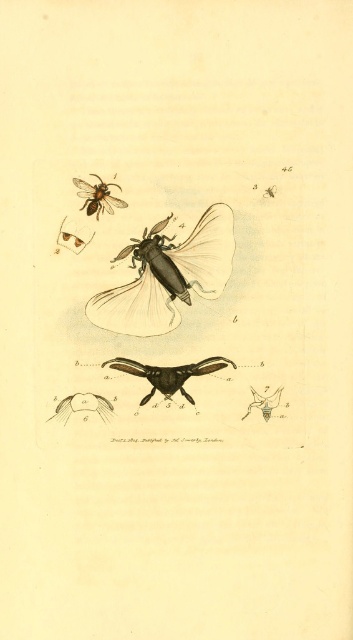
Does black glossy moth at center appear over matte brown bee at upper left?

No.

How much distance is there between black glossy moth at center and matte brown bee at upper left?

They are 12.87 inches apart.

Between point (140, 372) and point (92, 193), which one is positioned in front?

Point (92, 193) is more forward.

Find the location of a particular element. black glossy moth at center is located at coordinates (168, 372).

Between point (151, 384) and point (62, 404), which one is positioned behind?

The point (151, 384) is more distant.

Is black glossy moth at center wider than smooth brown feather at lower left?

Yes, black glossy moth at center is wider than smooth brown feather at lower left.

What do you see at coordinates (168, 372) in the screenshot? The height and width of the screenshot is (640, 353). I see `black glossy moth at center` at bounding box center [168, 372].

This screenshot has width=353, height=640. I want to click on black glossy moth at center, so click(x=168, y=372).

Who is more distant from viewer, (127, 324) or (116, 200)?

Positioned behind is point (127, 324).

Is matte black insect at center taller than matte brown bee at upper left?

Yes, matte black insect at center is taller than matte brown bee at upper left.

Does point (146, 259) come in front of point (81, 179)?

No, (146, 259) is further to viewer.

The width and height of the screenshot is (353, 640). What are the coordinates of `matte black insect at center` in the screenshot? It's located at (168, 275).